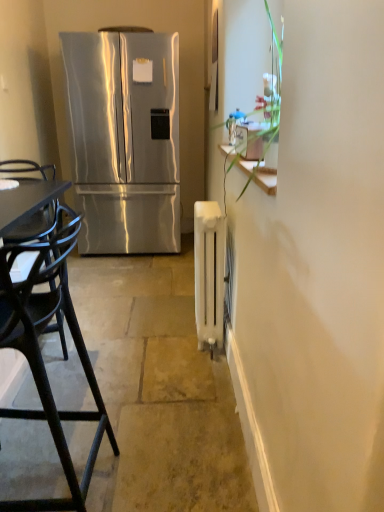
Locate an element on the screen. The image size is (384, 512). vacant area that lies in front of white matte radiator at center is located at coordinates (192, 361).